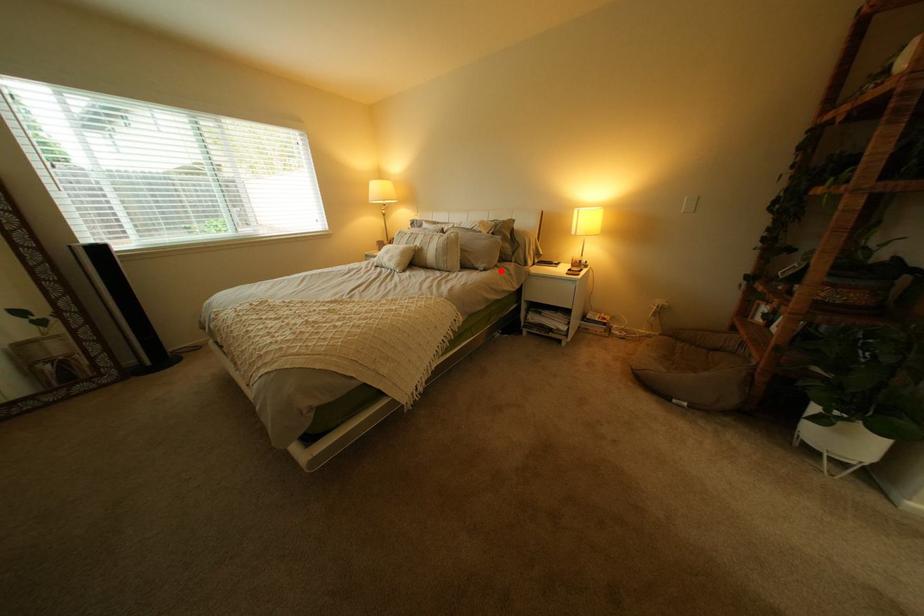
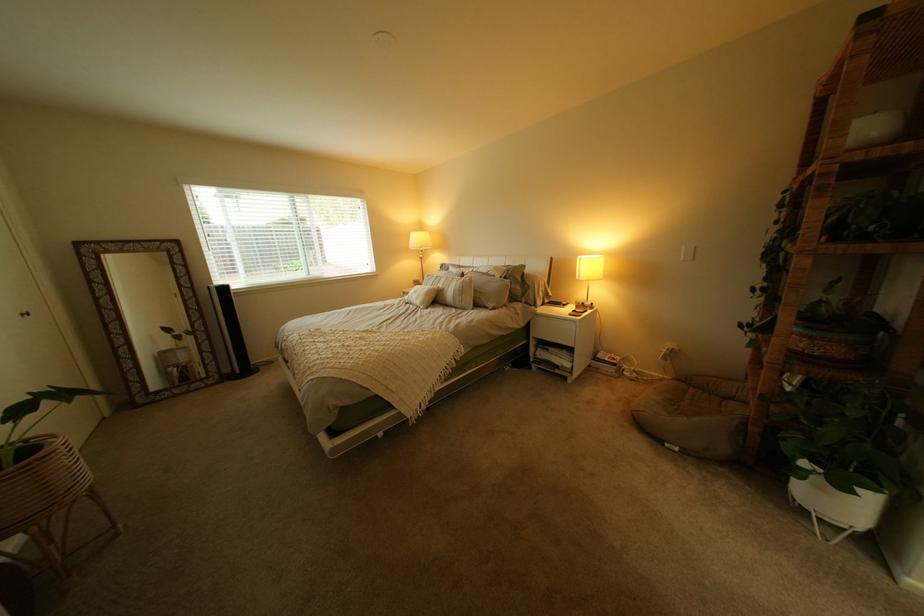
Find the pixel in the second image that matches the highlighted location in the first image.

(509, 310)